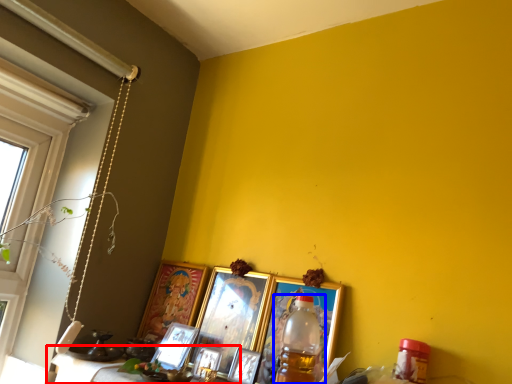
Question: Which object appears closest to the camera in this image, table (highlighted by a red box) or bottle (highlighted by a blue box)?

Choices:
 (A) table
 (B) bottle

Answer: (B)